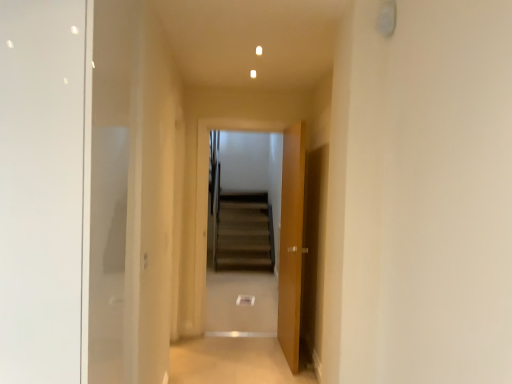
Question: Considering the positions of point (209, 352) and point (219, 226), is point (209, 352) closer or farther from the camera than point (219, 226)?

Choices:
 (A) farther
 (B) closer

Answer: (B)

Question: In the image, is beige carpet at center positioned in front of or behind brown carpeted stairs at center?

Choices:
 (A) front
 (B) behind

Answer: (A)

Question: Estimate the real-world distances between objects in this image. Which object is closer to the brown carpeted stairs at center?

Choices:
 (A) wooden door at center
 (B) beige carpet at center

Answer: (B)

Question: Considering the real-world distances, which object is closest to the brown carpeted stairs at center?

Choices:
 (A) wooden door at center
 (B) beige carpet at center

Answer: (B)